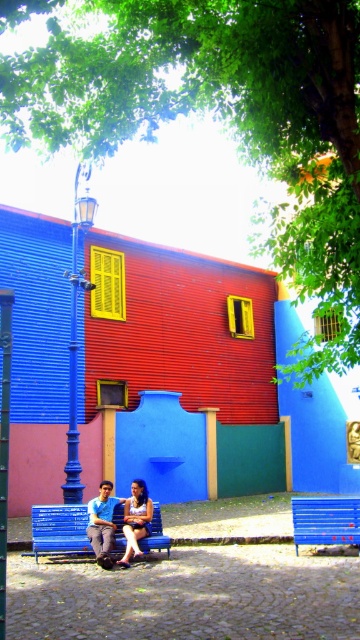
Who is more forward, (6, 387) or (135, 515)?

Positioned in front is point (6, 387).

Is brushed metal pole at left behind matte blue dress at center?

No, it is not.

Between point (10, 346) and point (142, 492), which one is positioned behind?

Positioned behind is point (142, 492).

This screenshot has height=640, width=360. What are the coordinates of `brushed metal pole at left` in the screenshot? It's located at (3, 440).

Is blue painted bench at center to the left of matte blue dress at center from the viewer's perspective?

Yes, blue painted bench at center is to the left of matte blue dress at center.

Can you confirm if blue painted bench at center is positioned above matte blue dress at center?

No.

The width and height of the screenshot is (360, 640). I want to click on blue painted bench at center, so click(59, 531).

This screenshot has height=640, width=360. Find the location of `blue painted bench at center`. blue painted bench at center is located at coordinates (59, 531).

Between brushed metal pole at left and blue denim jeans at center, which one has less height?

Standing shorter between the two is blue denim jeans at center.

Does brushed metal pole at left have a lesser width compared to blue denim jeans at center?

Correct, brushed metal pole at left's width is less than blue denim jeans at center's.

Which is in front, point (2, 579) or point (99, 508)?

Point (2, 579) is more forward.

Identify the location of brushed metal pole at left. The height and width of the screenshot is (640, 360). (3, 440).